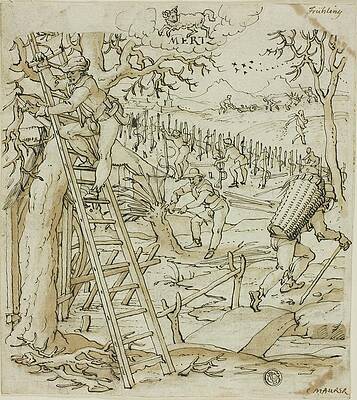
Locate an element on the screen. The width and height of the screenshot is (357, 400). basket is located at coordinates (295, 200).